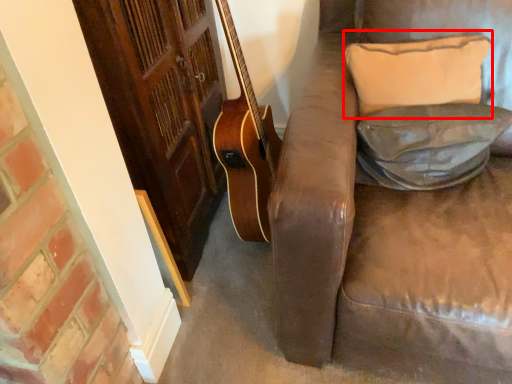
Question: From the image's perspective, what is the correct spatial positioning of pillow (annotated by the red box) in reference to pillow?

Choices:
 (A) below
 (B) above

Answer: (B)